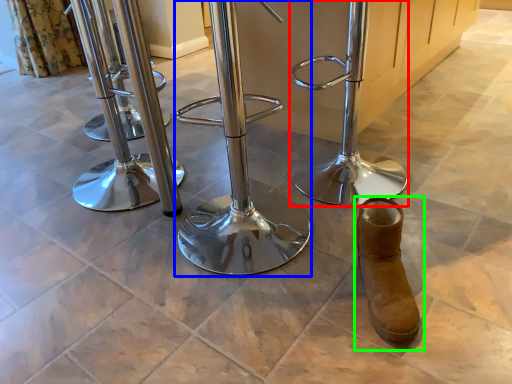
Question: Which object is positioned farthest from swivel chair (highlighted by a red box)? Select from swivel chair (highlighted by a blue box) and footwear (highlighted by a green box).

Choices:
 (A) swivel chair
 (B) footwear

Answer: (B)